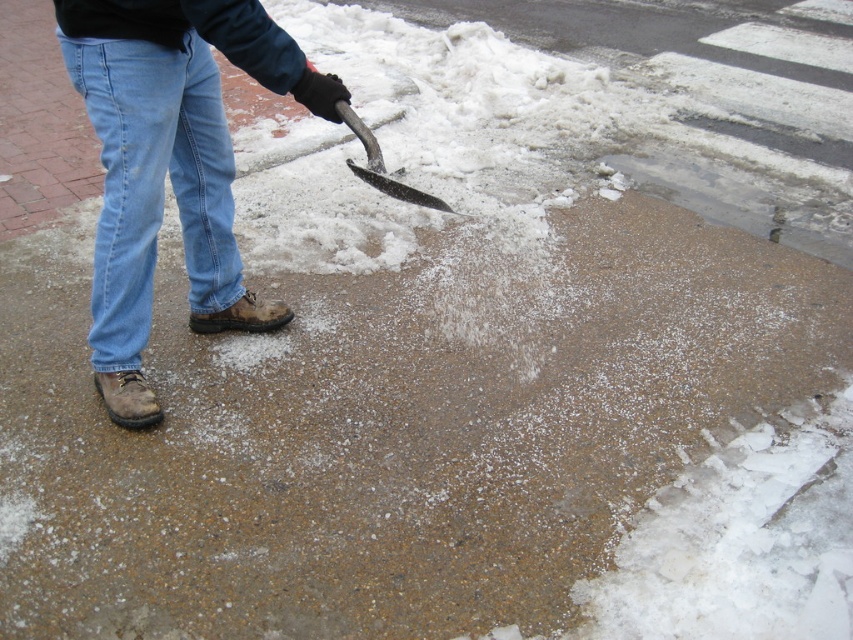
Question: Among these objects, which one is nearest to the camera?

Choices:
 (A) black metal shovel at center
 (B) denim at left

Answer: (A)

Question: Is denim at left above black metal shovel at center?

Choices:
 (A) yes
 (B) no

Answer: (B)

Question: Is denim at left bigger than black metal shovel at center?

Choices:
 (A) no
 (B) yes

Answer: (B)

Question: Does denim at left have a lesser width compared to black metal shovel at center?

Choices:
 (A) yes
 (B) no

Answer: (B)

Question: Which of the following is the farthest from the observer?

Choices:
 (A) denim at left
 (B) black metal shovel at center

Answer: (A)